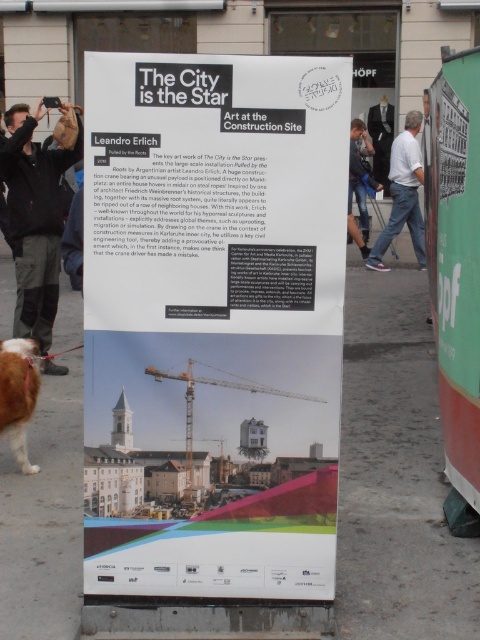
Consider the image. Does brown fur dog at lower left appear on the right side of denim jeans at center?

In fact, brown fur dog at lower left is to the left of denim jeans at center.

At what (x,y) coordinates should I click in order to perform the action: click on brown fur dog at lower left. Please return your answer as a coordinate pair (x, y). Looking at the image, I should click on (17, 396).

Is the position of green matte poster at right less distant than that of denim jeans at center?

No, green matte poster at right is further to the viewer.

Is green matte poster at right smaller than denim jeans at center?

Indeed, green matte poster at right has a smaller size compared to denim jeans at center.

Locate an element on the screen. The width and height of the screenshot is (480, 640). green matte poster at right is located at coordinates (456, 259).

At what (x,y) coordinates should I click in order to perform the action: click on green matte poster at right. Please return your answer as a coordinate pair (x, y). Looking at the image, I should click on (456, 259).

Can you confirm if green matte poster at right is smaller than black jacket at left?

Correct, green matte poster at right occupies less space than black jacket at left.

Find the location of a particular element. Image resolution: width=480 pixels, height=640 pixels. green matte poster at right is located at coordinates (456, 259).

Is point (424, 124) farther from camera compared to point (1, 177)?

Yes, point (424, 124) is farther from viewer.

The width and height of the screenshot is (480, 640). I want to click on green matte poster at right, so click(456, 259).